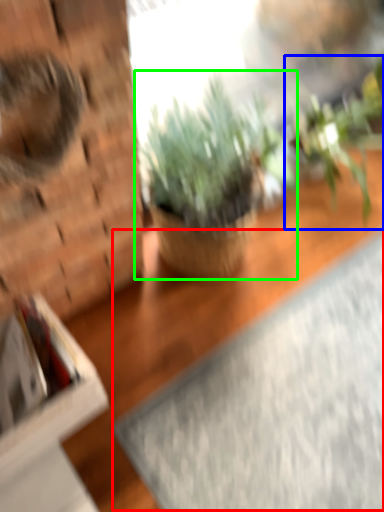
Question: Which is farther away from yoga mat (highlighted by a red box)? houseplant (highlighted by a blue box) or houseplant (highlighted by a green box)?

Choices:
 (A) houseplant
 (B) houseplant

Answer: (A)